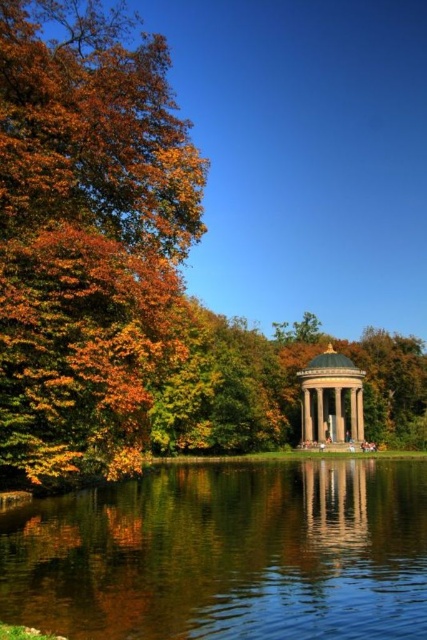
Question: Which point is farther from the camera taking this photo?

Choices:
 (A) (278, 516)
 (B) (309, 404)

Answer: (B)

Question: Can you confirm if autumn leaves at left is positioned below transparent water at center?

Choices:
 (A) yes
 (B) no

Answer: (B)

Question: Among these points, which one is nearest to the camera?

Choices:
 (A) (336, 403)
 (B) (111, 35)

Answer: (B)

Question: Estimate the real-world distances between objects in this image. Which object is farther from the white marble gazebo at center?

Choices:
 (A) autumn leaves at left
 (B) transparent water at center

Answer: (A)

Question: Can you confirm if autumn leaves at left is positioned below transparent water at center?

Choices:
 (A) yes
 (B) no

Answer: (B)

Question: Does autumn leaves at left have a lesser width compared to white marble gazebo at center?

Choices:
 (A) yes
 (B) no

Answer: (B)